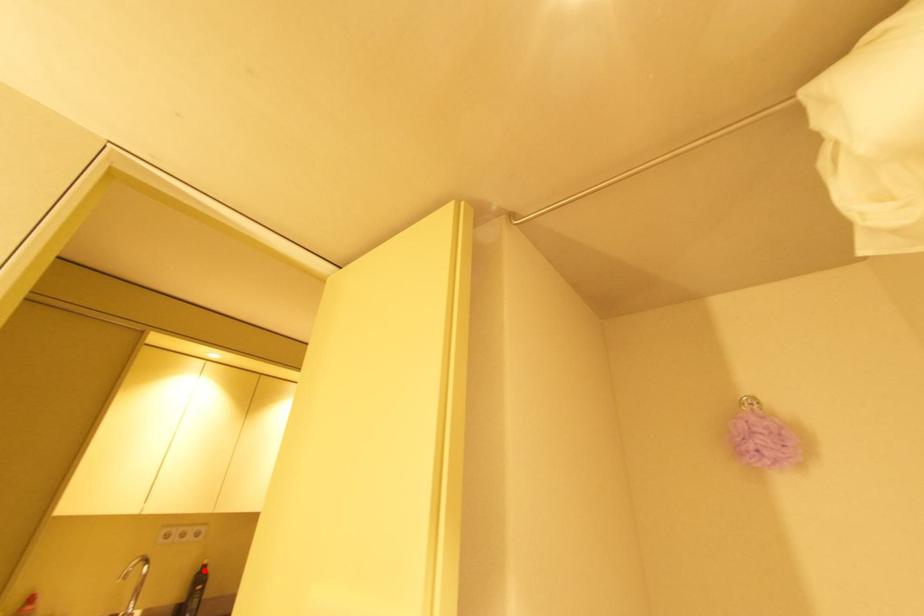
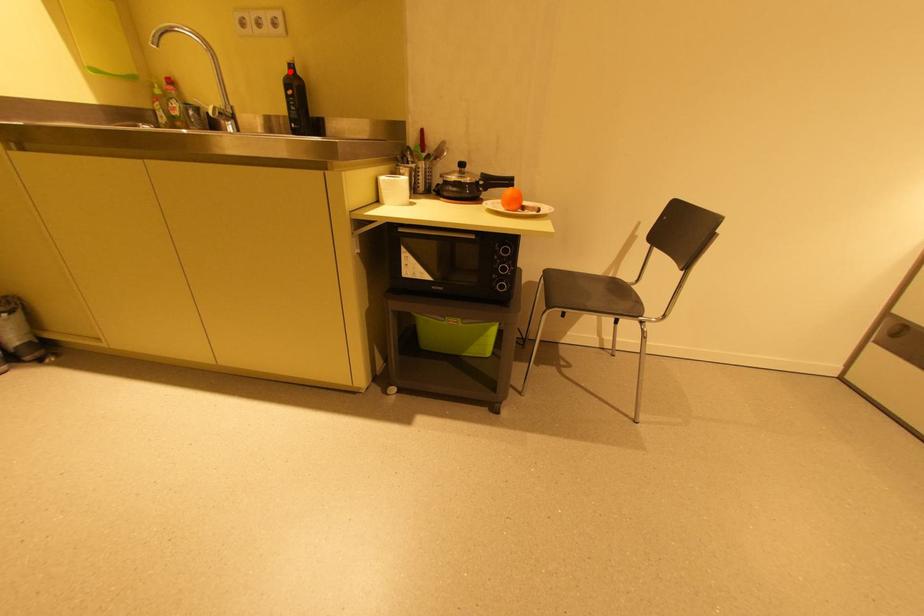
I am providing you with two images of the same scene from different viewpoints. A red point is marked on the first image and another point is marked on the second image. Is the red point in image1 aligned with the point shown in image2?

Yes